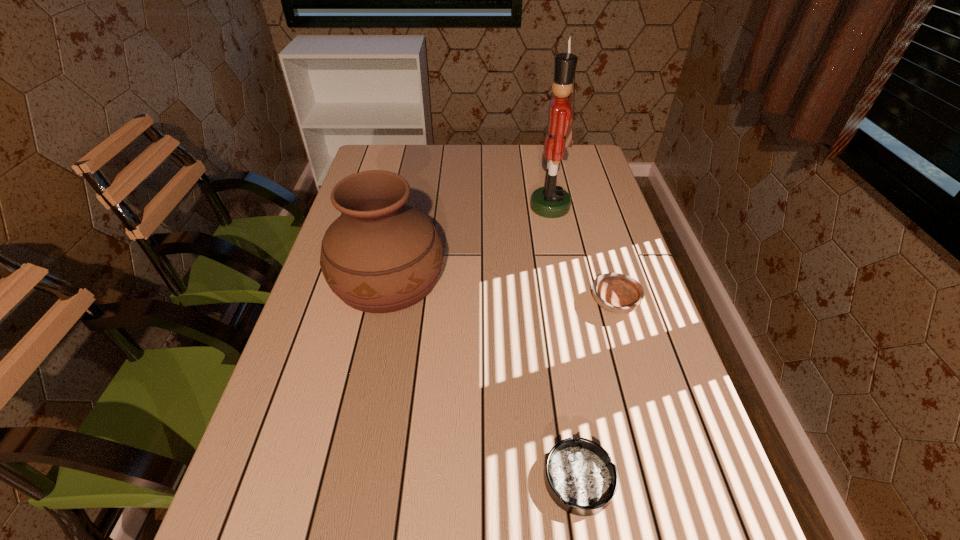
Identify which object is the second closest to the nearest object. Please provide its 2D coordinates. Your answer should be formatted as a tuple, i.e. [(x, y)], where the tuple contains the x and y coordinates of a point satisfying the conditions above.

[(380, 255)]

The height and width of the screenshot is (540, 960). Find the location of `free space that satisfies the following two spatial constraints: 1. on the front-facing side of the tallest object; 2. on the back side of the bowl`. free space that satisfies the following two spatial constraints: 1. on the front-facing side of the tallest object; 2. on the back side of the bowl is located at coordinates (569, 303).

Locate an element on the screen. free space that satisfies the following two spatial constraints: 1. on the back side of the second shortest object; 2. on the front-facing side of the farthest object is located at coordinates (586, 207).

Find the location of `free location that satisfies the following two spatial constraints: 1. on the front-facing side of the second shortest object; 2. on the right side of the nutcracker`. free location that satisfies the following two spatial constraints: 1. on the front-facing side of the second shortest object; 2. on the right side of the nutcracker is located at coordinates (569, 303).

You are a GUI agent. You are given a task and a screenshot of the screen. Output one action in this format:
    pyautogui.click(x=<x>, y=<y>)
    Task: Click on the free space that satisfies the following two spatial constraints: 1. on the back side of the third tallest object; 2. on the front-facing side of the farthest object
    The image size is (960, 540).
    Given the screenshot: What is the action you would take?
    pyautogui.click(x=586, y=207)

Find the location of a particular element. vacant space that satisfies the following two spatial constraints: 1. on the front-facing side of the farthest object; 2. on the right side of the bowl is located at coordinates (569, 303).